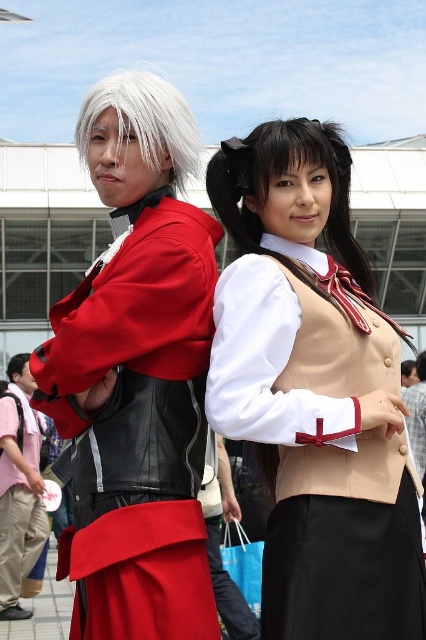
Question: Estimate the real-world distances between objects in this image. Which object is farther from the whitehair at left?

Choices:
 (A) black silky hair at center
 (B) matte black vest at left
 (C) brushed metal backpack at lower left
 (D) beige fabric vest at center

Answer: (C)

Question: Does beige fabric vest at center have a greater width compared to matte black vest at left?

Choices:
 (A) yes
 (B) no

Answer: (A)

Question: Which of the following is the farthest from the observer?

Choices:
 (A) (83, 502)
 (B) (276, 244)

Answer: (B)

Question: Which point is farther to the camera?

Choices:
 (A) beige fabric vest at center
 (B) whitehair at center
 (C) matte black vest at left
 (D) whitehair at left

Answer: (B)

Question: Does brushed metal backpack at lower left appear over whitehair at center?

Choices:
 (A) no
 (B) yes

Answer: (A)

Question: Observing the image, what is the correct spatial positioning of beige fabric vest at center in reference to brushed metal backpack at lower left?

Choices:
 (A) below
 (B) above

Answer: (B)